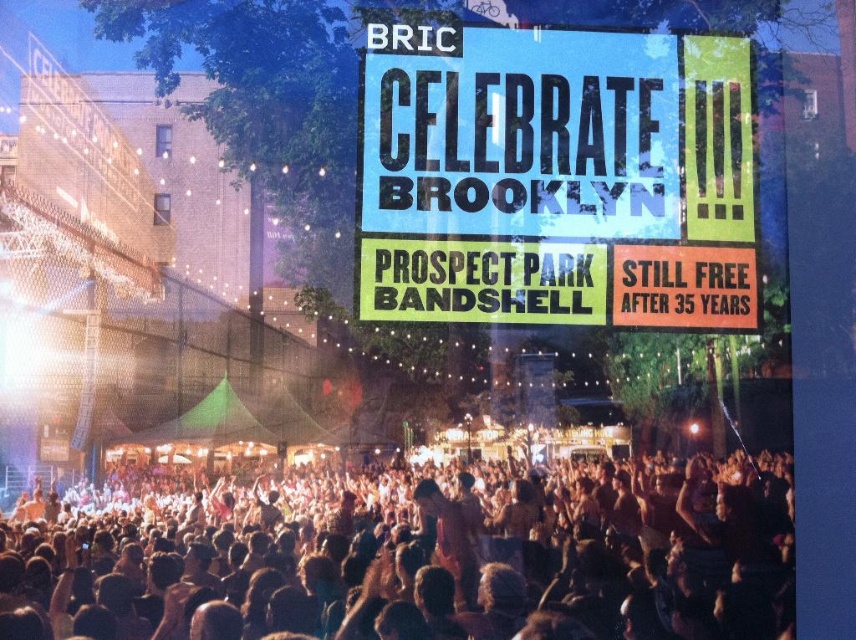
Question: Considering the relative positions of human flesh at center and blue paper sign at upper center in the image provided, where is human flesh at center located with respect to blue paper sign at upper center?

Choices:
 (A) right
 (B) left

Answer: (B)

Question: Which object appears closest to the camera in this image?

Choices:
 (A) blue paper sign at upper center
 (B) human flesh at center

Answer: (B)

Question: Considering the relative positions of human flesh at center and blue paper sign at upper center in the image provided, where is human flesh at center located with respect to blue paper sign at upper center?

Choices:
 (A) above
 (B) below

Answer: (B)

Question: Which of the following is the closest to the observer?

Choices:
 (A) (428, 147)
 (B) (733, 582)

Answer: (A)

Question: Observing the image, what is the correct spatial positioning of human flesh at center in reference to blue paper sign at upper center?

Choices:
 (A) right
 (B) left

Answer: (B)